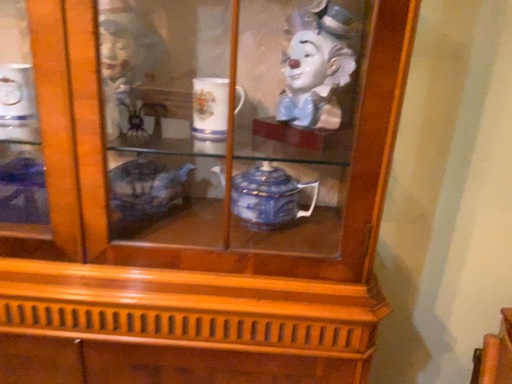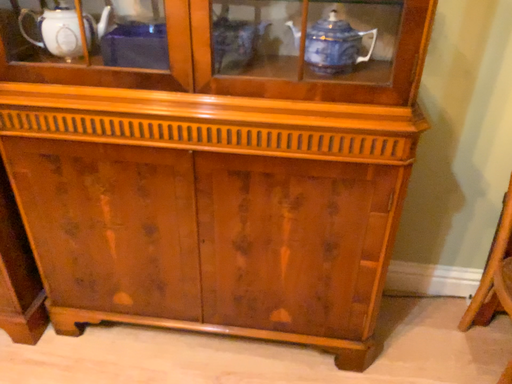
Question: How did the camera likely rotate when shooting the video?

Choices:
 (A) rotated left
 (B) rotated right

Answer: (A)